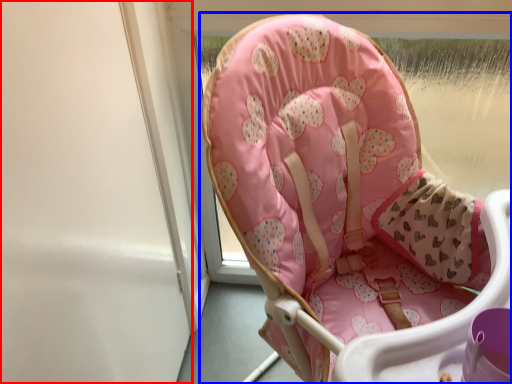
Question: Which object appears farthest to the camera in this image, screen door (highlighted by a red box) or chair (highlighted by a blue box)?

Choices:
 (A) screen door
 (B) chair

Answer: (A)